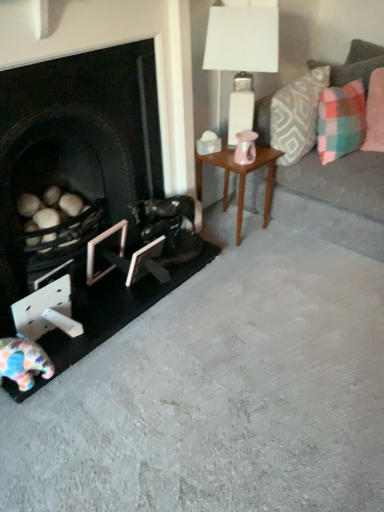
Locate an element on the screen. This screenshot has height=512, width=384. free space to the left of white matte picture frame at lower center, which is counted as the 1th picture frame, starting from the right is located at coordinates click(109, 296).